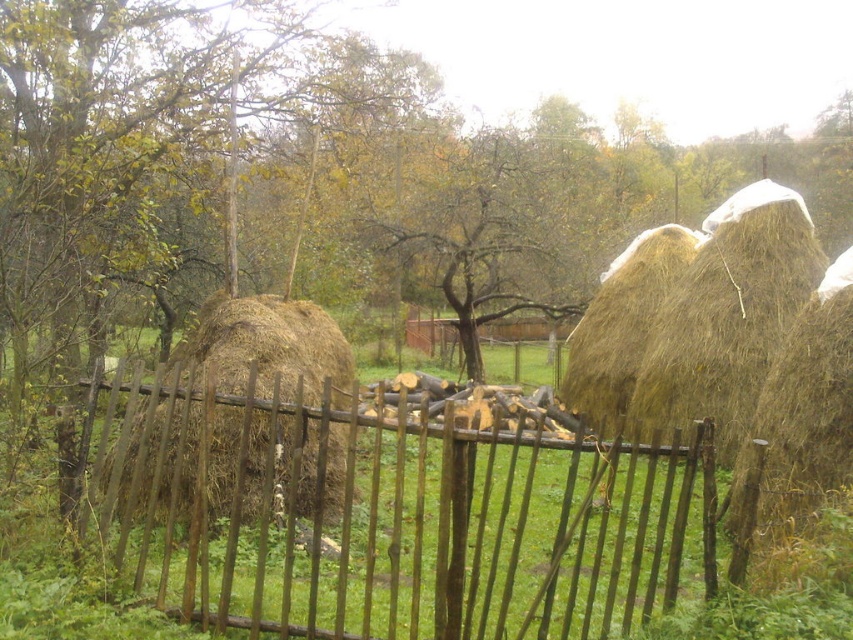
You are a farmer who needs to transport both the brown straw bale at right and the brown rough hay at left. If you have a truck bed that can only fit items up to the width of the wider object, which object should you prioritize loading first to ensure both fit?

The brown rough hay at left is wider than the brown straw bale at right. Therefore, you should load the brown rough hay at left first to ensure it fits in the truck bed before placing the narrower brown straw bale at right.